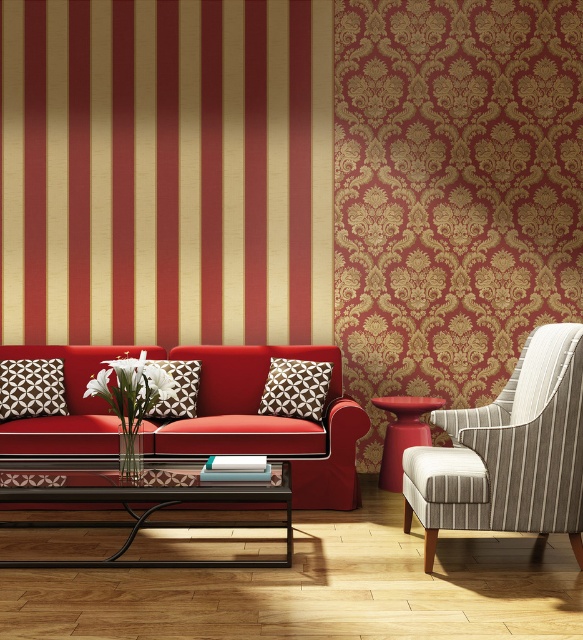
Question: Is metallic black coffee table at lower center above white textured pillow at center?

Choices:
 (A) yes
 (B) no

Answer: (B)

Question: Is striped fabric armchair at right bigger than matte white pillow with geometric pattern at center?

Choices:
 (A) yes
 (B) no

Answer: (A)

Question: Which point is farther from the camera taking this photo?

Choices:
 (A) (535, 506)
 (B) (321, 365)

Answer: (B)

Question: Which point is closer to the camera taking this photo?

Choices:
 (A) (434, 497)
 (B) (139, 378)
 (C) (174, 410)

Answer: (A)

Question: Observing the image, what is the correct spatial positioning of striped fabric armchair at right in reference to matte white pillow with geometric pattern at center?

Choices:
 (A) left
 (B) right

Answer: (B)

Question: Which is nearer to the white textured pillow at center?

Choices:
 (A) matte white pillow with geometric pattern at center
 (B) white matte flower at center
 (C) striped fabric armchair at right
 (D) matte red sofa at center

Answer: (D)